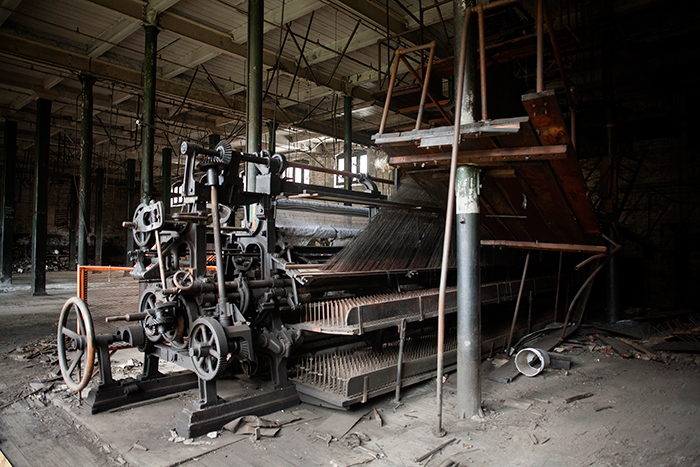
Find the location of a particular element. pillars is located at coordinates (28, 211), (73, 222), (133, 142), (253, 127).